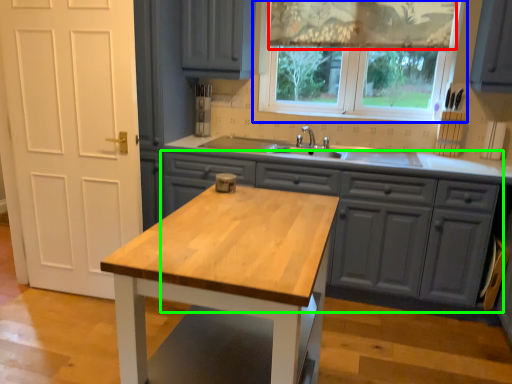
Question: Which is farther away from curtain (highlighted by a red box)? window (highlighted by a blue box) or cabinetry (highlighted by a green box)?

Choices:
 (A) window
 (B) cabinetry

Answer: (B)